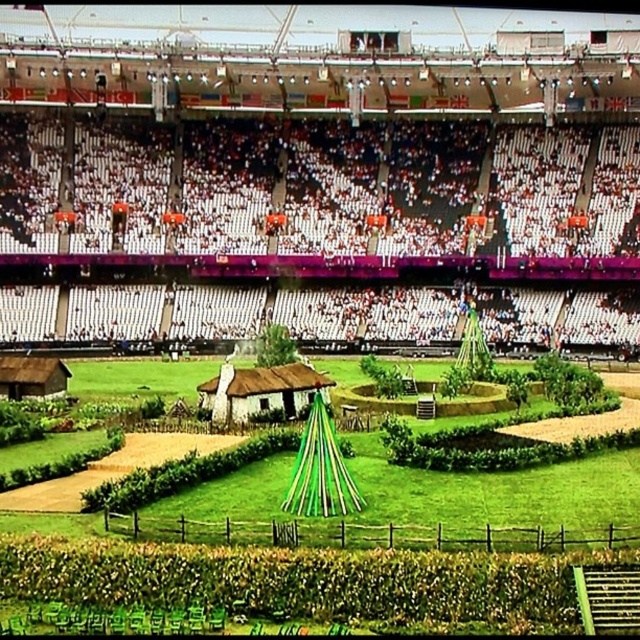
You are attending an event at the stadium and want to find the rustic thatched hut at center. Based on its coordinates, in which general direction should you look from the seating area?

The rustic thatched hut at center is located at coordinates approximately 0.611 on the x and 0.408 on the y. Since the seating area is typically at the perimeter, you should look towards the center of the stadium where the hut is positioned.

You are a photographer positioned at the back of the stadium and want to capture both the rustic thatched hut at center and the brown wooden hut at lower left in a single photo. Which hut will appear closer to the camera in the photo?

The rustic thatched hut at center will appear closer to the camera because it is positioned in front of the brown wooden hut at lower left.

You are standing at the center of the stadium and want to take a photo that includes both the point at coordinates point (250, 413) and point (56, 385). Based on their positions, which point will appear larger in your photo?

Point (250, 413) is closer to the camera than point (56, 385), so it will appear larger in the photo.